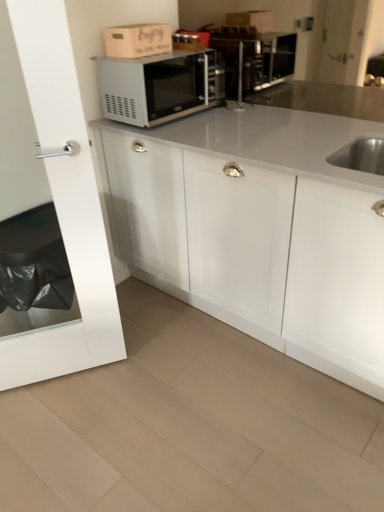
Locate an element on the screen. vacant region in front of satin silver microwave at upper center is located at coordinates (205, 134).